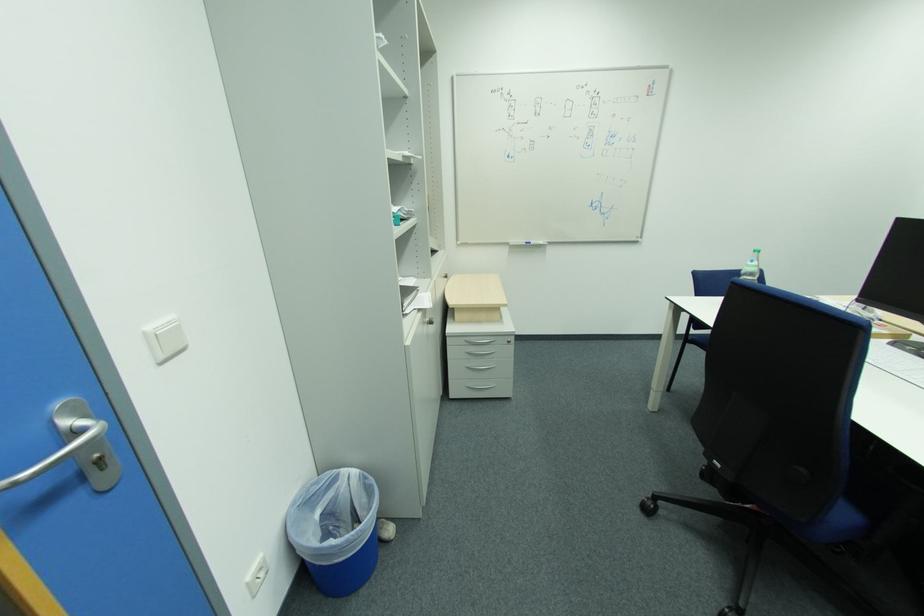
Find where to grasp the blue whiteboard marker. Please return your answer as a coordinate pair (x, y).

(527, 243)